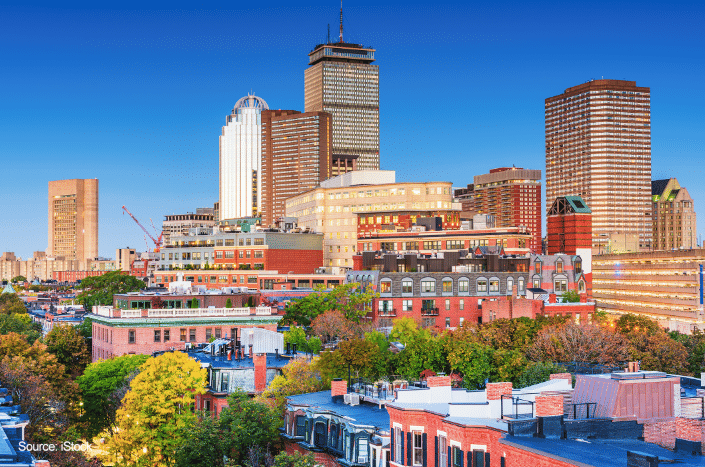
The image size is (705, 467). I want to click on windows, so click(426, 284), click(448, 283).